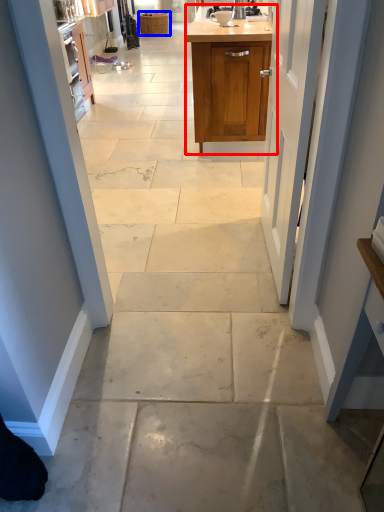
Question: Which object appears closest to the camera in this image, cabinetry (highlighted by a red box) or cabinetry (highlighted by a blue box)?

Choices:
 (A) cabinetry
 (B) cabinetry

Answer: (A)